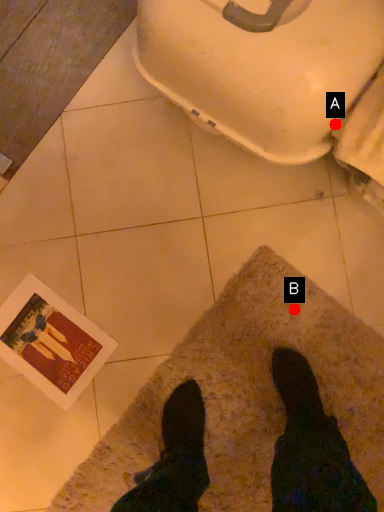
Question: Two points are circled on the image, labeled by A and B beside each circle. Which point appears closest to the camera in this image?

Choices:
 (A) A is closer
 (B) B is closer

Answer: (A)